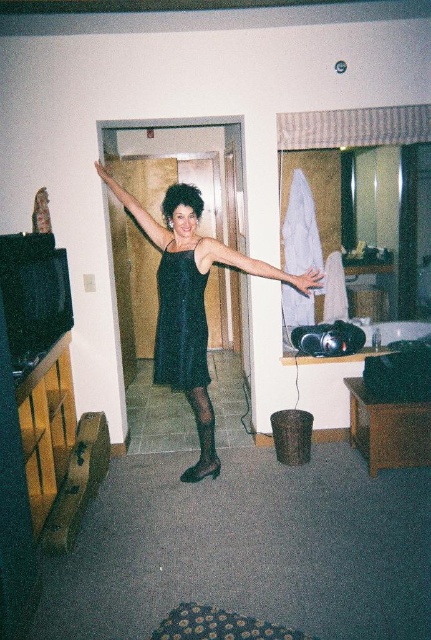
Question: Does black sequined dress at center appear under black satin dress at upper center?

Choices:
 (A) yes
 (B) no

Answer: (A)

Question: Which object is closer to the camera taking this photo?

Choices:
 (A) black satin dress at center
 (B) black sequined dress at center
 (C) shiny black dress at center

Answer: (A)

Question: Can you confirm if shiny black dress at center is positioned to the left of black sequined dress at center?

Choices:
 (A) yes
 (B) no

Answer: (B)

Question: Which object is closer to the camera taking this photo?

Choices:
 (A) black sequined dress at center
 (B) black satin dress at upper center

Answer: (A)

Question: Which point is farther to the camera?

Choices:
 (A) black sequined dress at center
 (B) shiny black dress at center
 (C) black satin dress at upper center

Answer: (C)

Question: Is black sequined dress at center bigger than black satin dress at upper center?

Choices:
 (A) no
 (B) yes

Answer: (A)